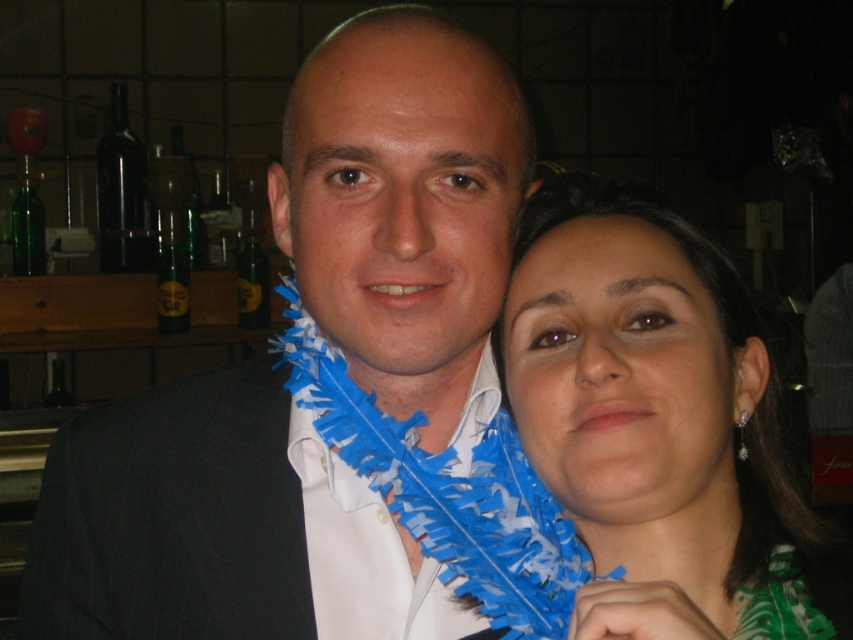
Question: In this image, where is matte black suit at center located relative to blue feather boa at right?

Choices:
 (A) below
 (B) above

Answer: (A)

Question: Which point is closer to the camera taking this photo?

Choices:
 (A) (785, 548)
 (B) (149, 579)

Answer: (A)

Question: Which object is closer to the camera taking this photo?

Choices:
 (A) matte black suit at center
 (B) blue feather boa at right

Answer: (B)

Question: Is matte black suit at center positioned before blue feather boa at right?

Choices:
 (A) no
 (B) yes

Answer: (A)

Question: Is matte black suit at center bigger than blue feather boa at right?

Choices:
 (A) yes
 (B) no

Answer: (A)